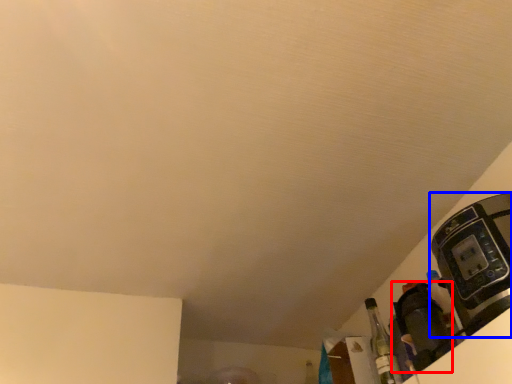
Question: Which object is further to the camera taking this photo, appliance (highlighted by a red box) or coffee machine (highlighted by a blue box)?

Choices:
 (A) appliance
 (B) coffee machine

Answer: (A)